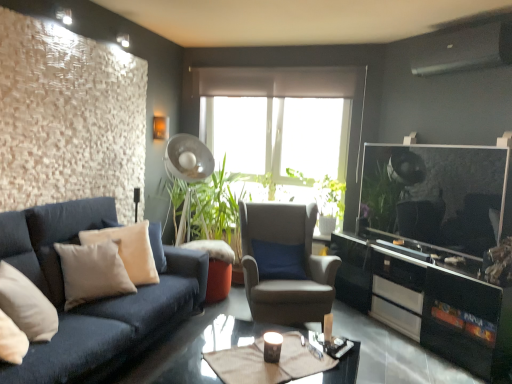
In order to click on vacant space underneath matte brown table at center (from a real-world perspective) in this screenshot , I will do `click(248, 367)`.